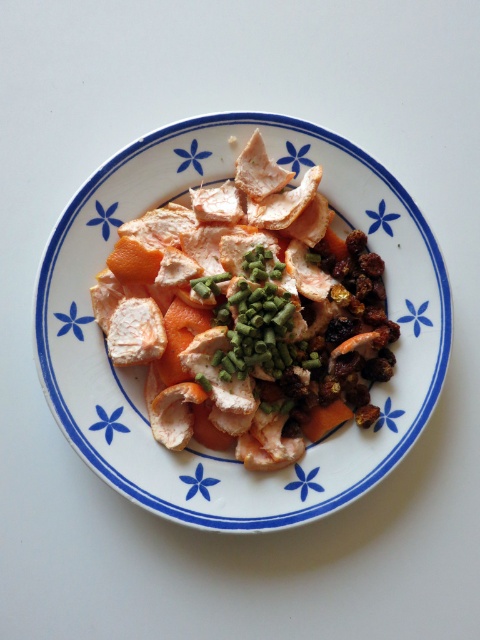
You are preparing a dish and need to know which ingredient takes up more space on the plate. Looking at the orange peel at center and the green chopped onion at center, which one is bigger?

The orange peel at center is larger in size than the green chopped onion at center, so it takes up more space on the plate.

You are looking at the plate of food and see two points marked on it. The first point is at coordinates point (151, 298) and the second is at point (240, 344). Which point is closer to you?

Point (151, 298) is further to the camera than point (240, 344), so the second point is closer to you.